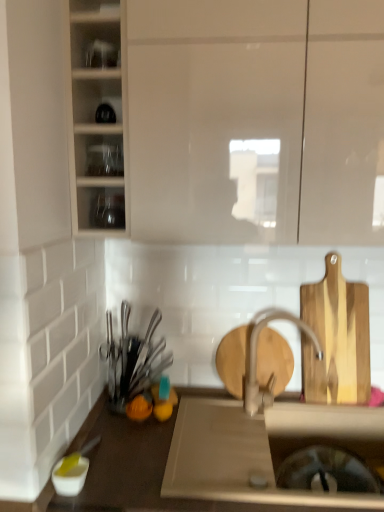
Identify the location of free area in between matte silver faucet at center and white glossy bowl at lower left, acting as the second tableware starting from the back. (187, 446).